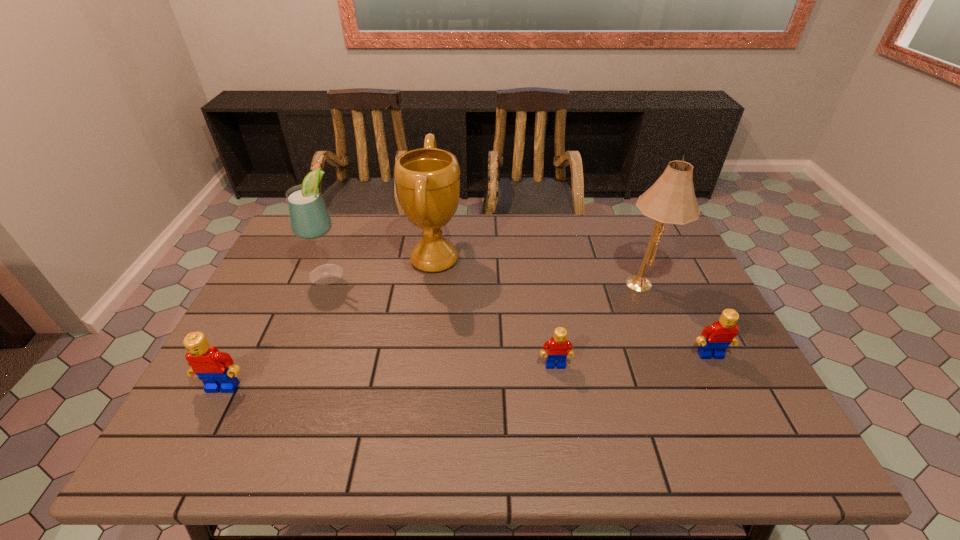
Identify the location of vacant space located 0.120m on the front-facing side of the fourth object from left to right. (564, 416).

Where is `blank area located 0.130m on the front-facing side of the rightmost Lego`? blank area located 0.130m on the front-facing side of the rightmost Lego is located at coordinates (737, 408).

Find the location of a particular element. This screenshot has height=540, width=960. free spot located 0.260m on the left of the lampshade is located at coordinates (526, 283).

Locate an element on the screen. vacant space positioned on the front of the third object from left to right with the decoration is located at coordinates (509, 259).

Where is `free point located on the back of the alcohol`? The width and height of the screenshot is (960, 540). free point located on the back of the alcohol is located at coordinates 339,244.

Locate an element on the screen. Image resolution: width=960 pixels, height=540 pixels. object that is at the far edge is located at coordinates (427, 180).

The height and width of the screenshot is (540, 960). In order to click on object that is at the near edge in this screenshot , I will do `click(216, 369)`.

Identify the location of Lego situated at the left edge. (216, 369).

At what (x,y) coordinates should I click in order to perform the action: click on alcohol situated at the left edge. Please return your answer as a coordinate pair (x, y). This screenshot has width=960, height=540. Looking at the image, I should click on (309, 218).

Find the location of a particular element. Lego located at the right edge is located at coordinates (720, 334).